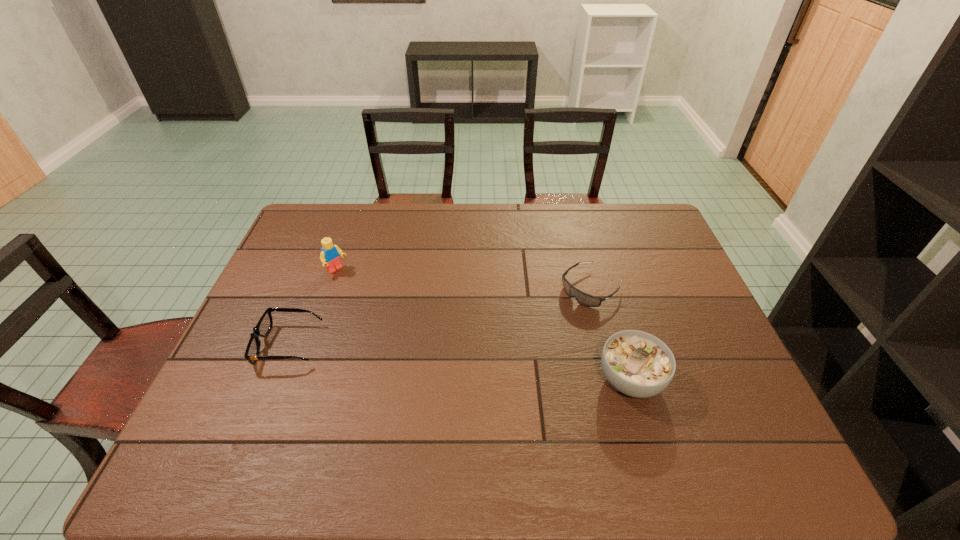
Where is `vacant spot on the desktop that is between the sunglasses and the third shortest object and is positioned on the lenses of the goggles`? The height and width of the screenshot is (540, 960). vacant spot on the desktop that is between the sunglasses and the third shortest object and is positioned on the lenses of the goggles is located at coordinates (492, 366).

The width and height of the screenshot is (960, 540). In order to click on free spot on the desktop that is between the sunglasses and the third shortest object and is positioned on the front-facing side of the tallest object in this screenshot , I will do `click(443, 361)`.